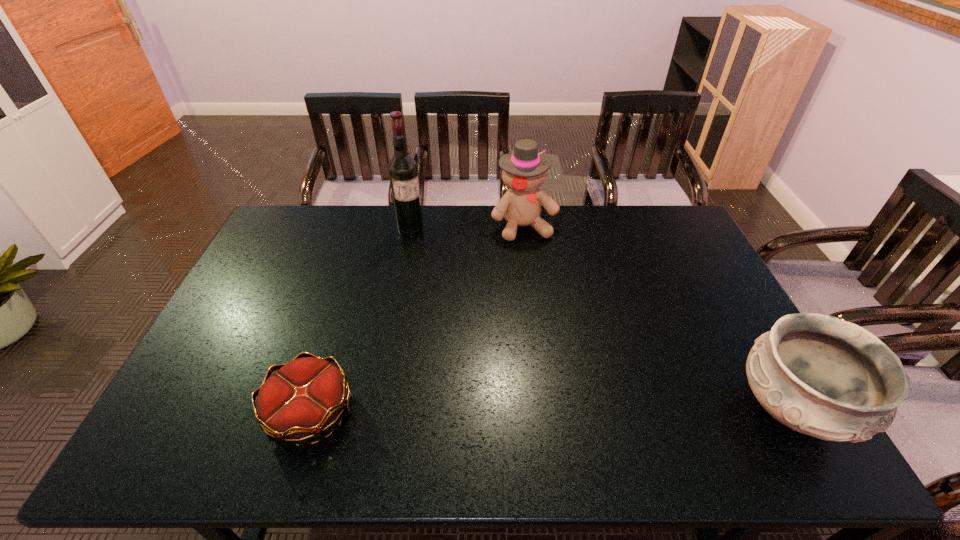
Image resolution: width=960 pixels, height=540 pixels. What are the coordinates of `free space between the second shortest object and the third object from right to left` in the screenshot? It's located at (601, 320).

Image resolution: width=960 pixels, height=540 pixels. In order to click on free spot between the rightmost object and the crown in this screenshot , I will do `click(551, 411)`.

The width and height of the screenshot is (960, 540). In order to click on vacant region between the second object from right to left and the pottery in this screenshot , I will do `click(658, 318)`.

Locate an element on the screen. vacant area that lies between the wine bottle and the third tallest object is located at coordinates (601, 320).

Locate an element on the screen. This screenshot has width=960, height=540. free spot between the third shortest object and the second object from left to right is located at coordinates (468, 228).

The height and width of the screenshot is (540, 960). I want to click on free area in between the shortest object and the rightmost object, so click(551, 411).

I want to click on vacant area between the rightmost object and the crown, so click(551, 411).

Locate an element on the screen. The image size is (960, 540). free point between the third object from right to left and the rightmost object is located at coordinates (601, 320).

At what (x,y) coordinates should I click in order to perform the action: click on the closest object relative to the rightmost object. Please return your answer as a coordinate pair (x, y). This screenshot has width=960, height=540. Looking at the image, I should click on click(524, 171).

The width and height of the screenshot is (960, 540). Find the location of `the third closest object relative to the third tallest object`. the third closest object relative to the third tallest object is located at coordinates (403, 173).